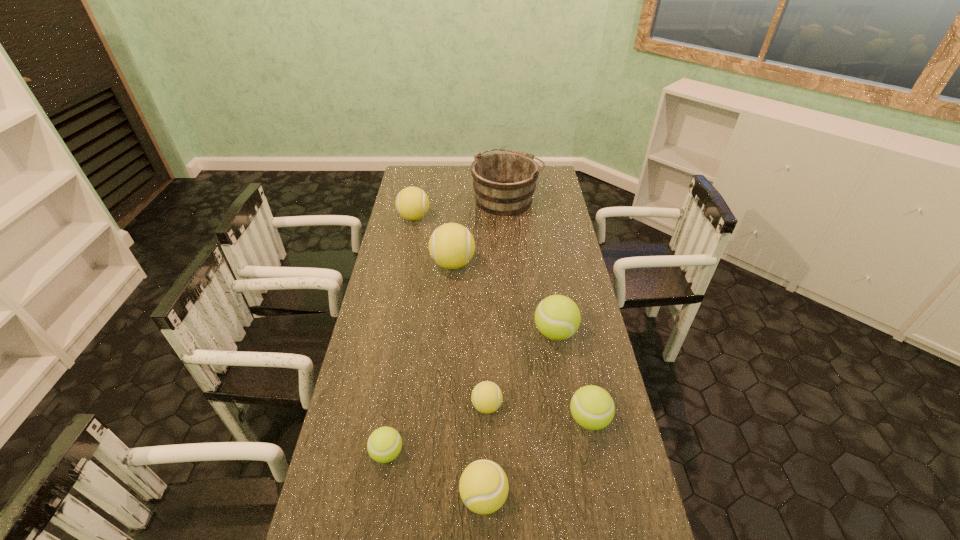
Where is `wine bucket`? wine bucket is located at coordinates click(x=504, y=182).

Where is `the sixth nearest tennis ball`? This screenshot has width=960, height=540. the sixth nearest tennis ball is located at coordinates (451, 245).

Identify the location of the third nearest yellow tennis ball. (451, 245).

Image resolution: width=960 pixels, height=540 pixels. I want to click on the fourth farthest object, so click(x=557, y=317).

Identify the location of the farthest green tennis ball. (557, 317).

You are a GUI agent. You are given a task and a screenshot of the screen. Output one action in this format:
    pyautogui.click(x=<x>, y=<y>)
    Task: Click on the second biggest yellow tennis ball
    The image size is (960, 540).
    Given the screenshot: What is the action you would take?
    pyautogui.click(x=412, y=203)

The image size is (960, 540). In order to click on the leftmost yellow tennis ball in this screenshot , I will do `click(412, 203)`.

Image resolution: width=960 pixels, height=540 pixels. I want to click on the nearest tennis ball, so click(483, 486).

Where is `the nearest object`? the nearest object is located at coordinates (483, 486).

You are a GUI agent. You are given a task and a screenshot of the screen. Output one action in this format:
    pyautogui.click(x=<x>, y=<y>)
    Task: Click on the second biggest green tennis ball
    Image resolution: width=960 pixels, height=540 pixels.
    Given the screenshot: What is the action you would take?
    pyautogui.click(x=592, y=407)